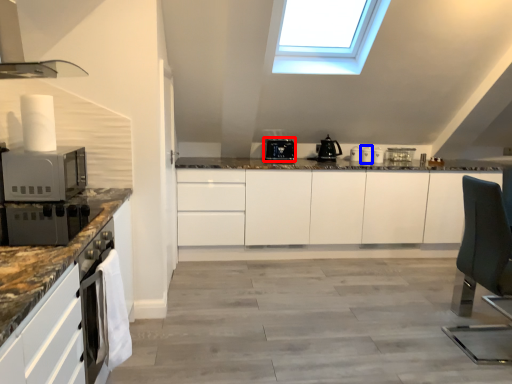
Question: Which object appears closest to the camera in this image, kitchen appliance (highlighted by a red box) or appliance (highlighted by a blue box)?

Choices:
 (A) kitchen appliance
 (B) appliance

Answer: (A)